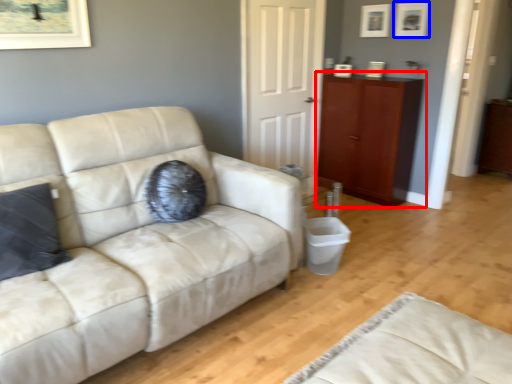
Question: Which object appears farthest to the camera in this image, cabinetry (highlighted by a red box) or picture frame (highlighted by a blue box)?

Choices:
 (A) cabinetry
 (B) picture frame

Answer: (B)